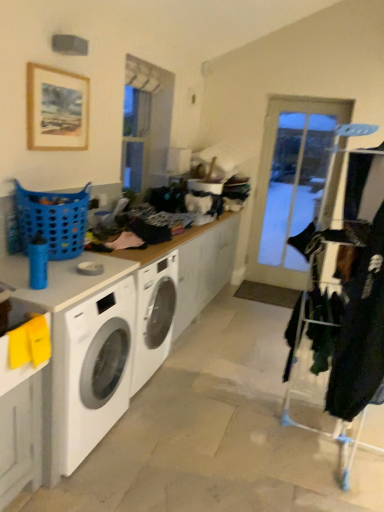
Question: Is the depth of blue plastic laundry basket at left less than that of wooden picture frame at upper left?

Choices:
 (A) no
 (B) yes

Answer: (B)

Question: Can wooden picture frame at upper left be found inside blue plastic laundry basket at left?

Choices:
 (A) yes
 (B) no

Answer: (B)

Question: Is blue plastic laundry basket at left taller than wooden picture frame at upper left?

Choices:
 (A) no
 (B) yes

Answer: (A)

Question: Is blue plastic laundry basket at left far from wooden picture frame at upper left?

Choices:
 (A) yes
 (B) no

Answer: (B)

Question: Is blue plastic laundry basket at left beside wooden picture frame at upper left?

Choices:
 (A) yes
 (B) no

Answer: (B)

Question: Which is correct: wooden picture frame at upper left is inside velvet black coat at right, or outside of it?

Choices:
 (A) inside
 (B) outside

Answer: (B)

Question: Would you say wooden picture frame at upper left is to the left or to the right of velvet black coat at right in the picture?

Choices:
 (A) left
 (B) right

Answer: (A)

Question: Is wooden picture frame at upper left in front of or behind velvet black coat at right in the image?

Choices:
 (A) front
 (B) behind

Answer: (B)

Question: From a real-world perspective, is wooden picture frame at upper left above or below velvet black coat at right?

Choices:
 (A) below
 (B) above

Answer: (B)

Question: Based on their positions, is white laminate counter top at center located to the left or right of clear glass screen door at center?

Choices:
 (A) right
 (B) left

Answer: (B)

Question: From the image's perspective, is white laminate counter top at center above or below clear glass screen door at center?

Choices:
 (A) below
 (B) above

Answer: (A)

Question: Relative to clear glass screen door at center, is white laminate counter top at center in front or behind?

Choices:
 (A) behind
 (B) front

Answer: (B)

Question: From a real-world perspective, is white laminate counter top at center above or below clear glass screen door at center?

Choices:
 (A) above
 (B) below

Answer: (B)

Question: Is point (336, 361) positioned closer to the camera than point (6, 285)?

Choices:
 (A) closer
 (B) farther

Answer: (B)

Question: In terms of height, does velvet black coat at right look taller or shorter compared to yellow matte sink at lower left?

Choices:
 (A) short
 (B) tall

Answer: (B)